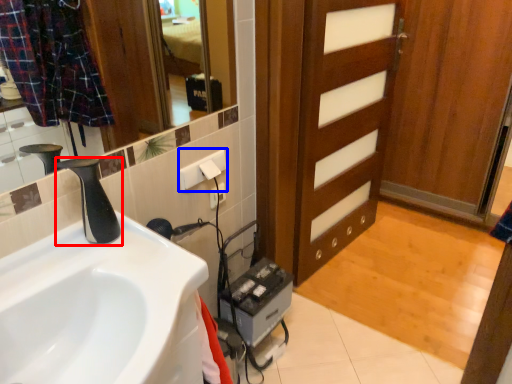
Question: Which object appears closest to the camera in this image, tap (highlighted by a red box) or electric outlet (highlighted by a blue box)?

Choices:
 (A) tap
 (B) electric outlet

Answer: (A)